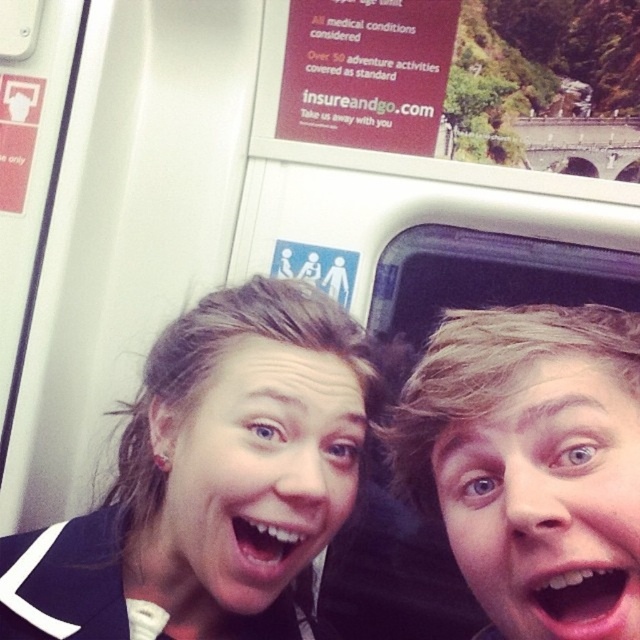
You are standing inside the train car and want to place a small sticker on the wall. You have two points marked as point (467, 416) and point (241, 550). Which point is closer to you if you are facing the front of the train?

Point (467, 416) is in front of point (241, 550), so if you are facing the front of the train, point (467, 416) is closer to you.